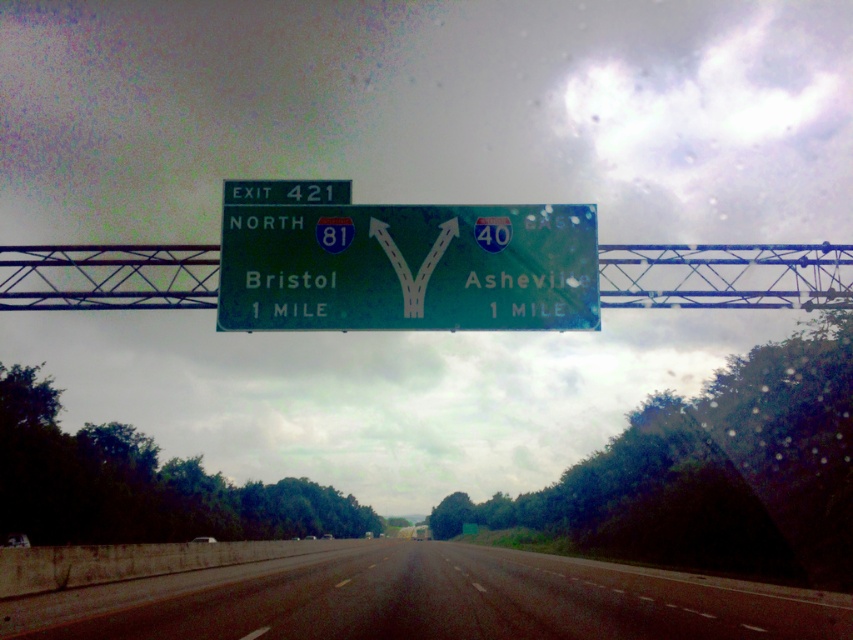
You are a GPS system trying to guide a driver to the black asphalt highway at center. What coordinates should you provide to the driver?

The coordinates for the black asphalt highway at center are at point (428, 602).

You are a driver approaching the green glossy sign at center. You need to stay on the black asphalt highway at center beyond the sign. Which direction should you drive relative to the sign to stay on the highway?

To stay on the black asphalt highway at center, you should drive below the green glossy sign at center since the highway is located below the sign.

You are a truck driver planning to pass through the black asphalt highway at center and notice the green glossy sign at center. Which object has a greater width from your perspective?

The black asphalt highway at center has a greater width than the green glossy sign at center.